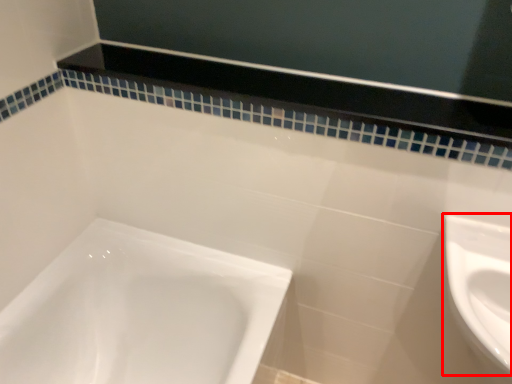
Question: From the image's perspective, where is sink (annotated by the red box) located relative to balustrade?

Choices:
 (A) below
 (B) above

Answer: (A)